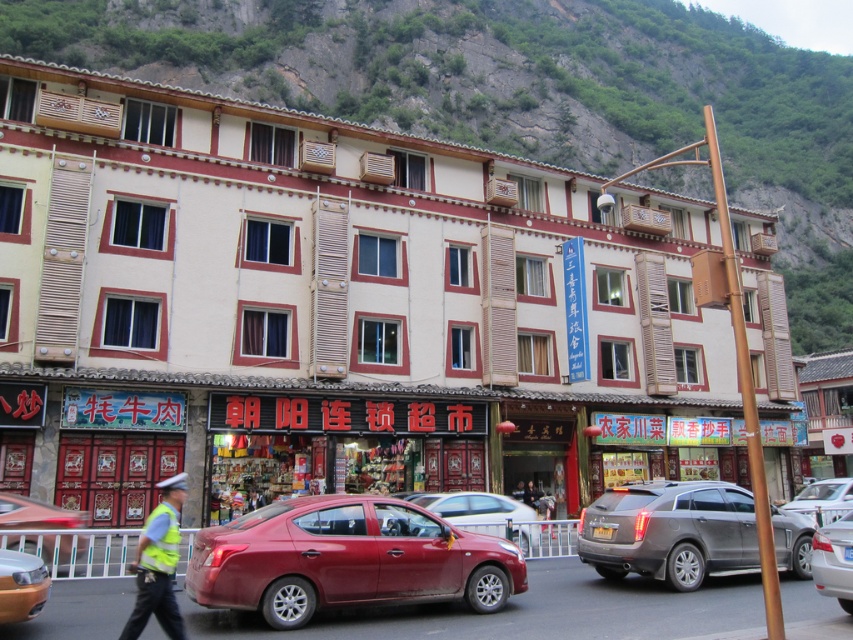
Does green rock at upper center have a larger size compared to yellow reflective vest at center?

Correct, green rock at upper center is larger in size than yellow reflective vest at center.

Image resolution: width=853 pixels, height=640 pixels. Describe the element at coordinates (520, 92) in the screenshot. I see `green rock at upper center` at that location.

Is point (840, 301) closer to camera compared to point (520, 483)?

No, it is not.

This screenshot has width=853, height=640. In order to click on green rock at upper center in this screenshot , I will do `click(520, 92)`.

Does point (44, 525) come farther from viewer compared to point (518, 484)?

No, (44, 525) is in front of (518, 484).

Find the location of a particular element. The image size is (853, 640). shiny red sedan at lower left is located at coordinates (36, 515).

Looking at this image, who is taller, metallic silver sedan at center or yellow reflective vest at center?

Standing taller between the two is metallic silver sedan at center.

Does metallic silver sedan at center have a smaller size compared to yellow reflective vest at center?

Actually, metallic silver sedan at center might be larger than yellow reflective vest at center.

You are a GUI agent. You are given a task and a screenshot of the screen. Output one action in this format:
    pyautogui.click(x=<x>, y=<y>)
    Task: Click on the metallic silver sedan at center
    The height and width of the screenshot is (640, 853).
    Given the screenshot: What is the action you would take?
    pyautogui.click(x=834, y=561)